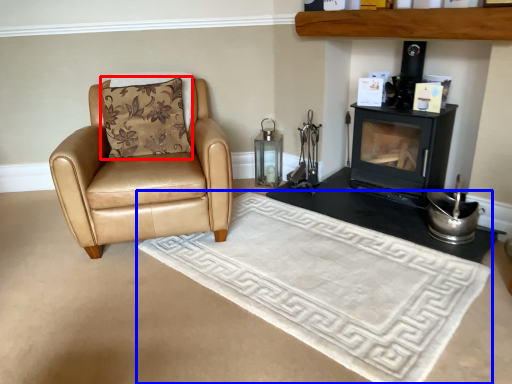
Question: Which object is further to the camera taking this photo, pillow (highlighted by a red box) or mat (highlighted by a blue box)?

Choices:
 (A) pillow
 (B) mat

Answer: (A)